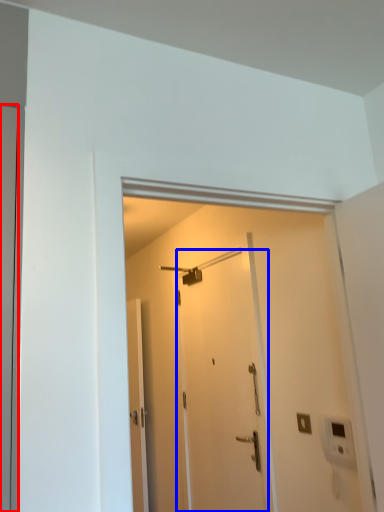
Question: Which of the following is the farthest to the observer, door (highlighted by a red box) or door (highlighted by a blue box)?

Choices:
 (A) door
 (B) door

Answer: (B)